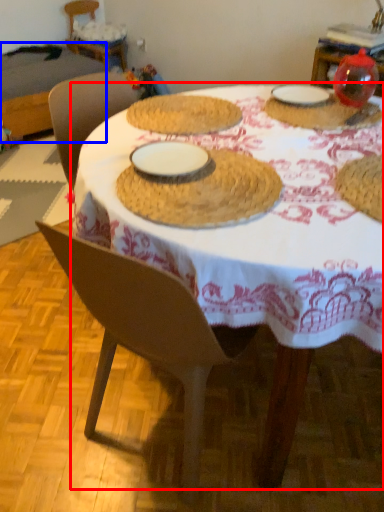
Question: Which object is further to the camera taking this photo, table (highlighted by a red box) or table (highlighted by a blue box)?

Choices:
 (A) table
 (B) table

Answer: (B)